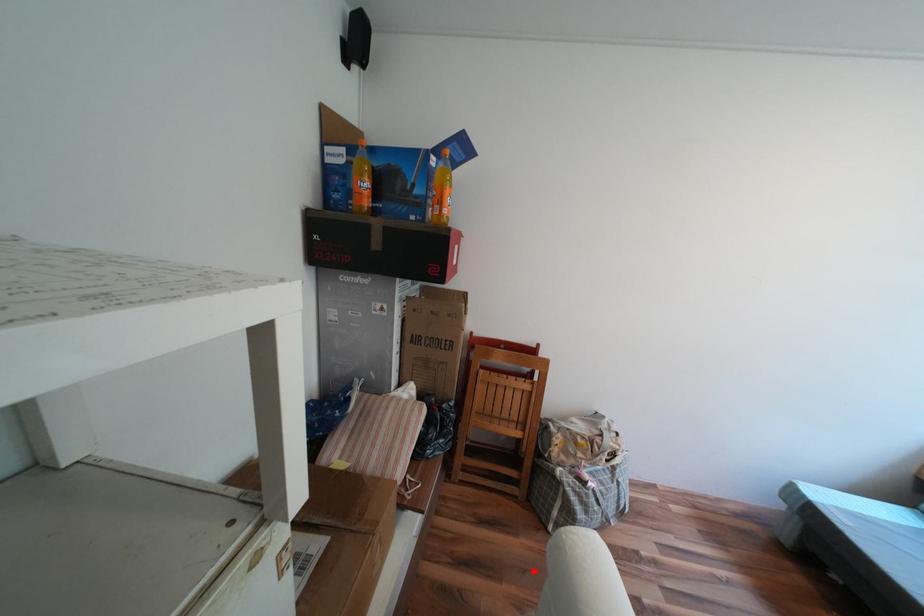
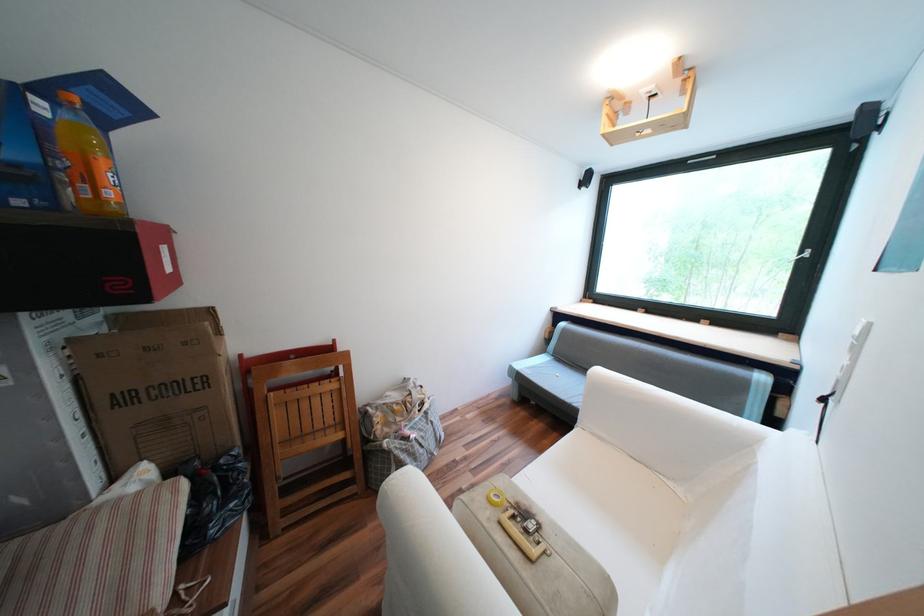
In the second image, find the point that corresponds to the highlighted location in the first image.

(387, 548)